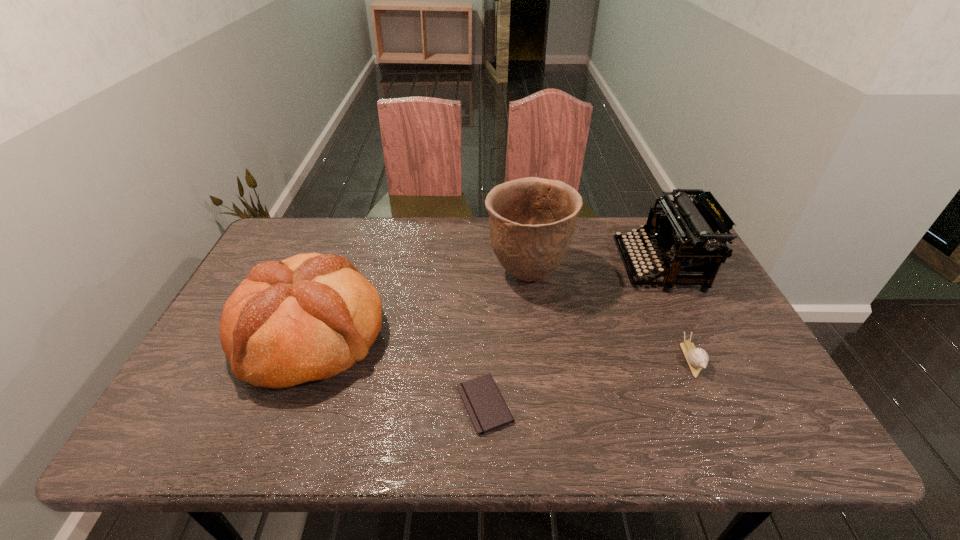
Find the location of a particular element. This screenshot has width=960, height=540. vacant space located on the shell of the escargot is located at coordinates (733, 450).

Where is `blank area located 0.140m on the left of the shortest object`? Image resolution: width=960 pixels, height=540 pixels. blank area located 0.140m on the left of the shortest object is located at coordinates (394, 404).

Where is `pottery at the far edge`? pottery at the far edge is located at coordinates (532, 220).

The height and width of the screenshot is (540, 960). What are the coordinates of `typewriter located in the far edge section of the desktop` in the screenshot? It's located at (687, 236).

Locate an element on the screen. The height and width of the screenshot is (540, 960). object that is positioned at the near edge is located at coordinates (487, 410).

Where is `object located at the left edge`? This screenshot has width=960, height=540. object located at the left edge is located at coordinates (309, 317).

Image resolution: width=960 pixels, height=540 pixels. I want to click on typewriter present at the right edge, so click(x=687, y=236).

You are a GUI agent. You are given a task and a screenshot of the screen. Output one action in this format:
    pyautogui.click(x=<x>, y=<y>)
    Task: Click on the escargot that is at the right edge
    Image resolution: width=960 pixels, height=540 pixels.
    Given the screenshot: What is the action you would take?
    pyautogui.click(x=697, y=358)

Where is `object that is positioned at the far right corner`? This screenshot has height=540, width=960. object that is positioned at the far right corner is located at coordinates (687, 236).

Identify the location of free space at the far edge of the desktop. (576, 222).